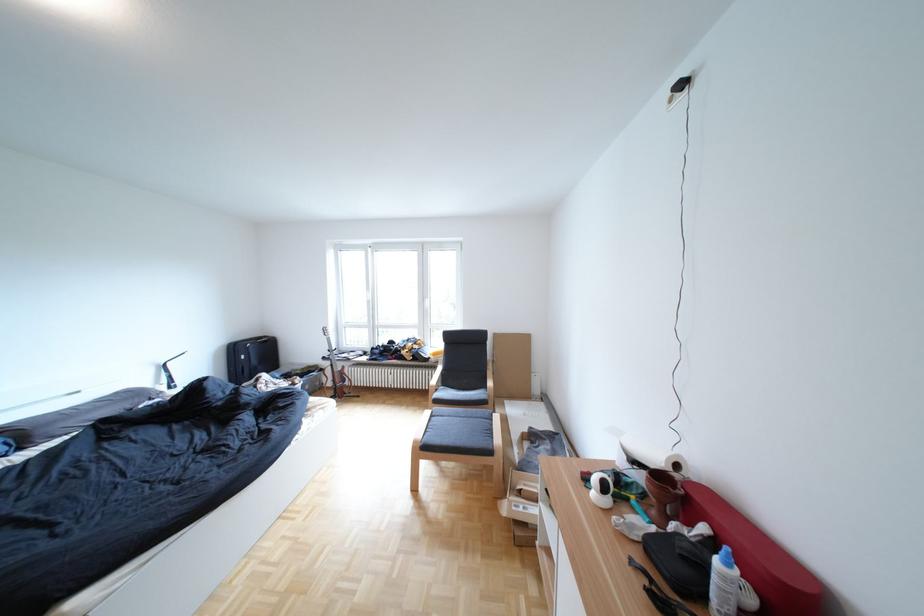
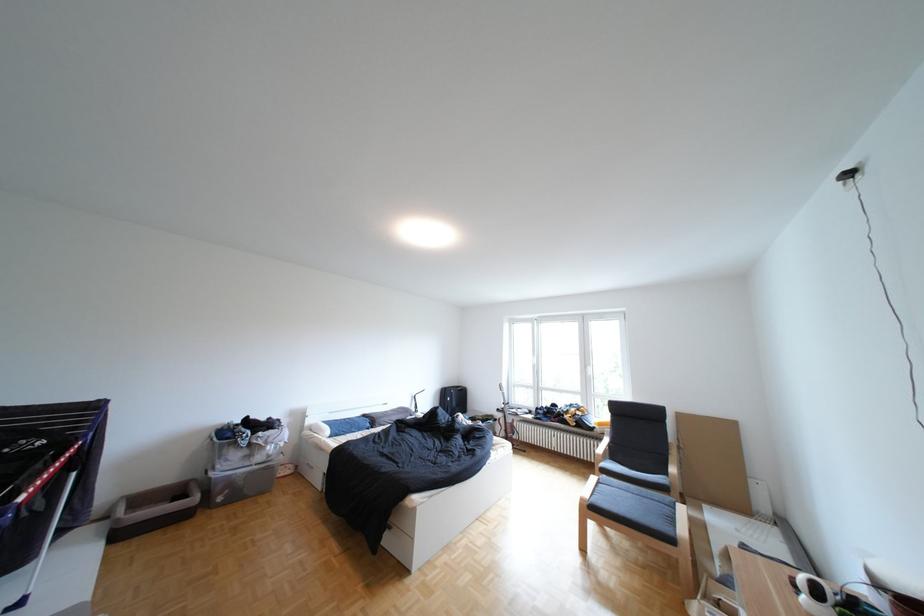
Where in the second image is the point corresponding to (443,414) from the first image?

(610, 479)